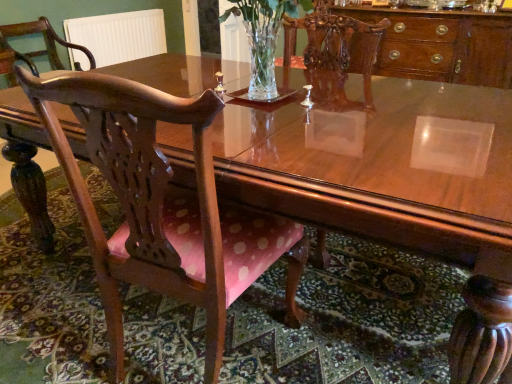
Where is `vacant space in front of clear glass vase at center`? vacant space in front of clear glass vase at center is located at coordinates (296, 129).